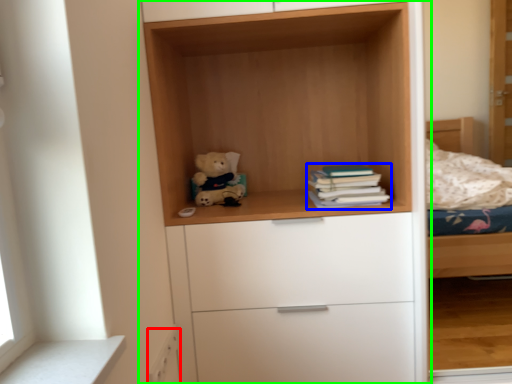
Question: Estimate the real-world distances between objects in this image. Which object is farther from drawer (highlighted by a red box), book (highlighted by a blue box) or cupboard (highlighted by a green box)?

Choices:
 (A) book
 (B) cupboard

Answer: (B)